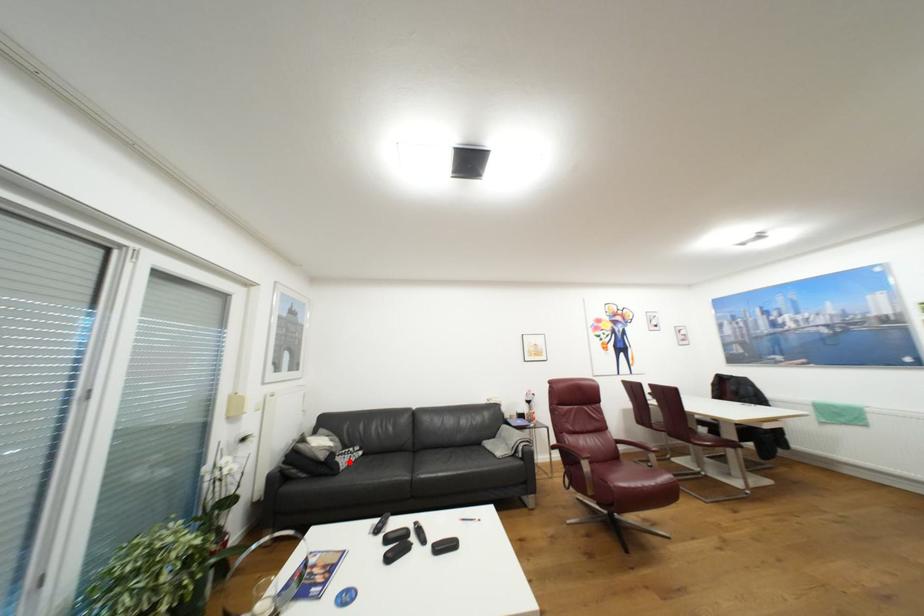
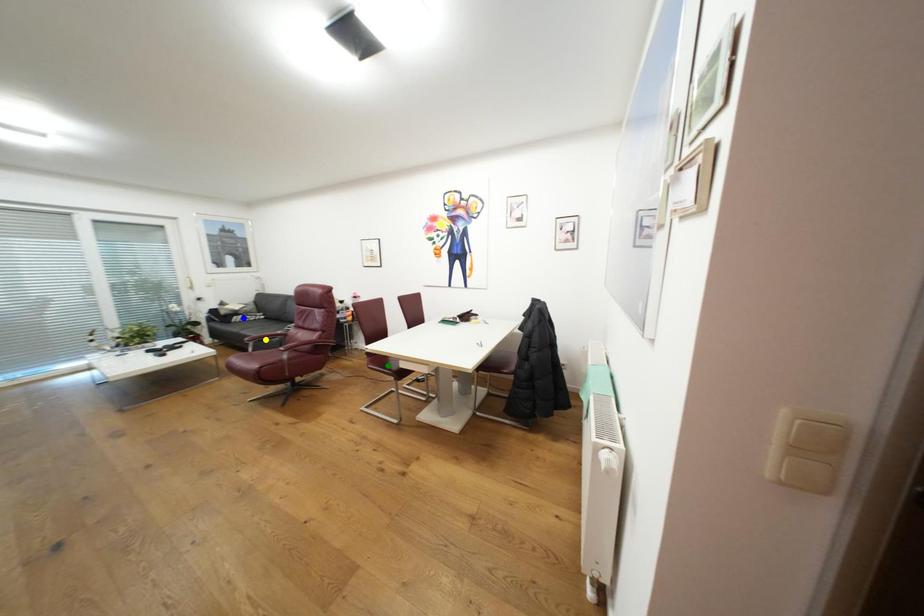
Question: I am providing you with two images of the same scene from different viewpoints. A red point is marked on the first image. You are given multiple points on the second image. Which mark in image 2 goes with the point in image 1?

Choices:
 (A) blue point
 (B) green point
 (C) yellow point

Answer: (A)